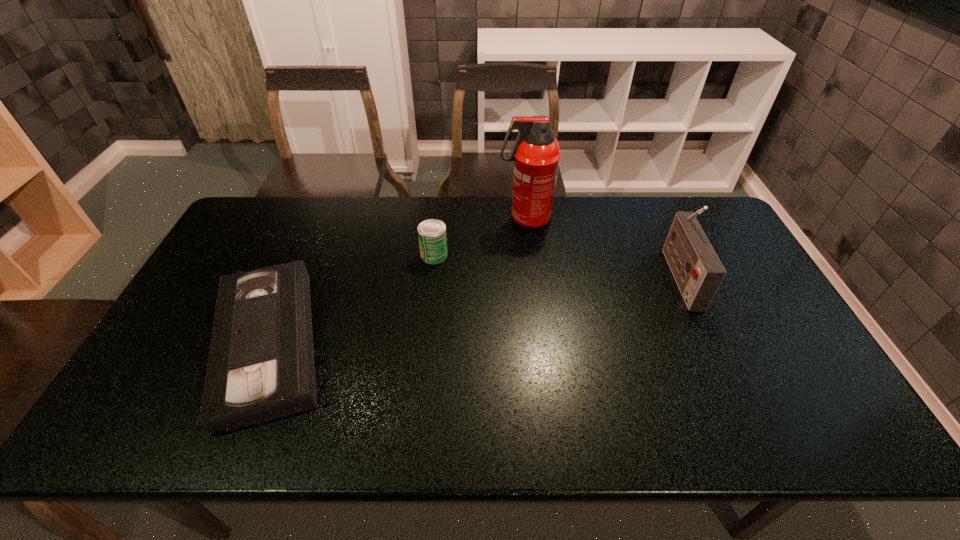
Find the location of a particular element. This screenshot has width=960, height=540. the farthest object is located at coordinates (536, 153).

At what (x,y) coordinates should I click in order to perform the action: click on the third object from left to right. Please return your answer as a coordinate pair (x, y). Looking at the image, I should click on (536, 153).

Locate an element on the screen. the second tallest object is located at coordinates (697, 270).

The height and width of the screenshot is (540, 960). I want to click on the rightmost object, so click(697, 270).

The width and height of the screenshot is (960, 540). I want to click on the third tallest object, so click(x=432, y=233).

What are the coordinates of `can` in the screenshot? It's located at (432, 233).

Locate an element on the screen. the leftmost object is located at coordinates (260, 367).

Locate an element on the screen. videotape is located at coordinates (260, 367).

Image resolution: width=960 pixels, height=540 pixels. Find the location of `free space located on the trigger side of the farthest object`. free space located on the trigger side of the farthest object is located at coordinates (464, 219).

Find the location of a particular element. The width and height of the screenshot is (960, 540). vacant point located on the trigger side of the farthest object is located at coordinates (472, 219).